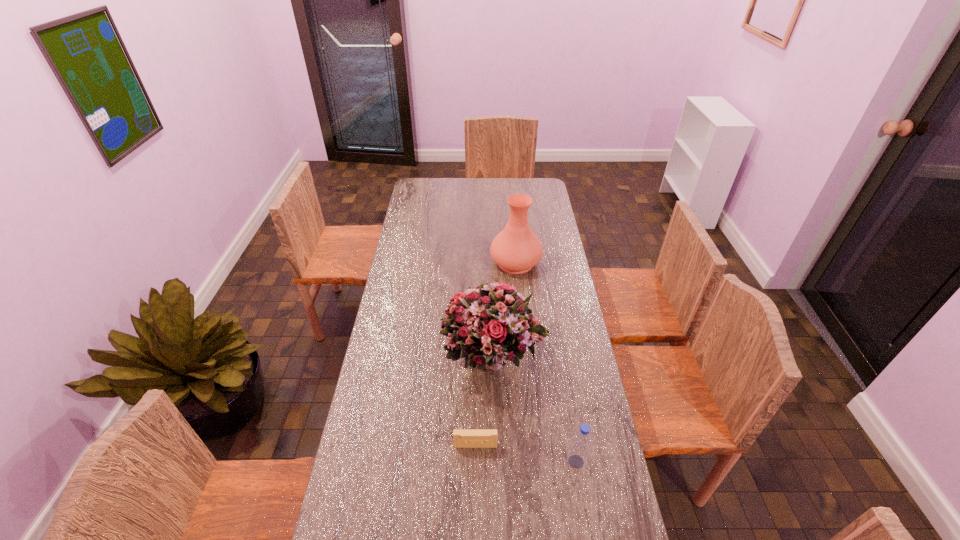
You are a GUI agent. You are given a task and a screenshot of the screen. Output one action in this format:
    pyautogui.click(x=<x>, y=<y>)
    Task: Click on the vase situated at the right edge
    This screenshot has width=960, height=540.
    Given the screenshot: What is the action you would take?
    pyautogui.click(x=516, y=249)

The height and width of the screenshot is (540, 960). I want to click on bouquet that is at the right edge, so click(489, 324).

Where is `bottle at the right edge`? The image size is (960, 540). bottle at the right edge is located at coordinates (578, 453).

In the image, there is a desktop. Where is `vacant area at the left edge`? The height and width of the screenshot is (540, 960). vacant area at the left edge is located at coordinates (419, 256).

In the image, there is a desktop. Where is `vacant space at the right edge`? vacant space at the right edge is located at coordinates (618, 490).

What are the coordinates of `free space at the far right corner of the desktop` in the screenshot? It's located at (525, 178).

Identify the location of free spot between the bottle and the bouquet. The width and height of the screenshot is (960, 540). (535, 410).

Image resolution: width=960 pixels, height=540 pixels. I want to click on blank region between the second farthest object and the nearest object, so click(x=535, y=410).

The image size is (960, 540). Find the location of `free space between the vase and the nearest object`. free space between the vase and the nearest object is located at coordinates (546, 362).

The image size is (960, 540). Find the location of `vacant area between the bouquet and the videotape`. vacant area between the bouquet and the videotape is located at coordinates (485, 402).